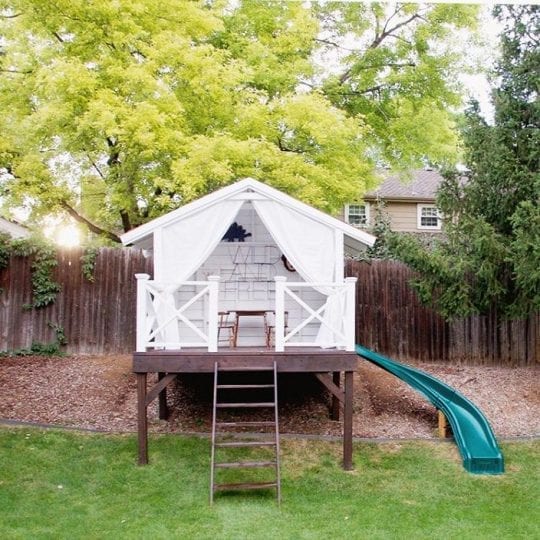
Locate an element on the screen. The image size is (540, 540). ladder is located at coordinates (256, 364).